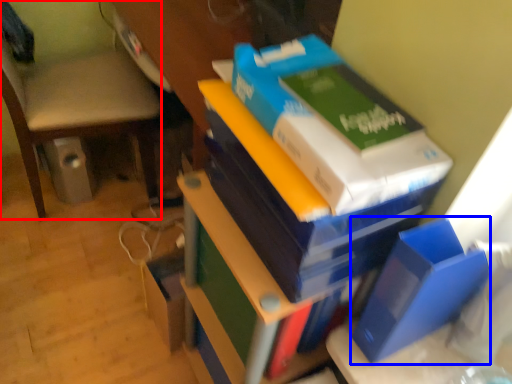
Question: Among these objects, which one is farthest to the camera, chair (highlighted by a red box) or paperback book (highlighted by a blue box)?

Choices:
 (A) chair
 (B) paperback book

Answer: (A)